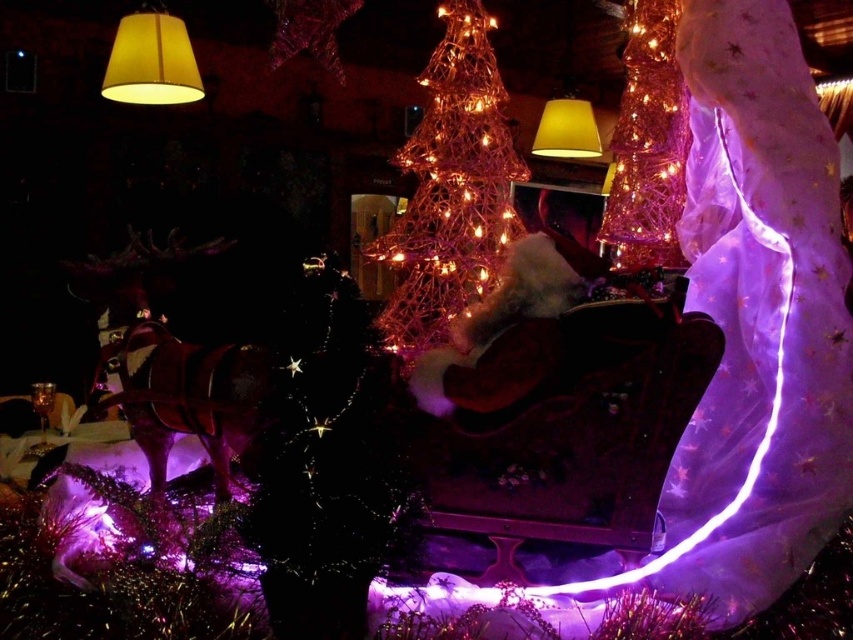
Question: Which point is closer to the camera?

Choices:
 (A) iridescent wireframe tree at center
 (B) iridescent wireframe cone at upper right
 (C) yellow fabric lampshade at upper left
 (D) yellow fabric lampshade at upper center

Answer: (A)

Question: Is the position of iridescent wireframe cone at upper right less distant than that of yellow fabric lampshade at upper center?

Choices:
 (A) yes
 (B) no

Answer: (A)

Question: Is iridescent wireframe tree at center wider than yellow fabric lampshade at upper center?

Choices:
 (A) yes
 (B) no

Answer: (B)

Question: Does iridescent wireframe tree at center have a smaller size compared to yellow fabric lampshade at upper left?

Choices:
 (A) no
 (B) yes

Answer: (A)

Question: Among these objects, which one is nearest to the camera?

Choices:
 (A) yellow fabric lampshade at upper left
 (B) yellow fabric lampshade at upper center
 (C) iridescent wireframe tree at center

Answer: (C)

Question: Which of the following is the farthest from the observer?

Choices:
 (A) (647, 227)
 (B) (456, 131)
 (C) (581, 156)
 (D) (177, 65)

Answer: (C)